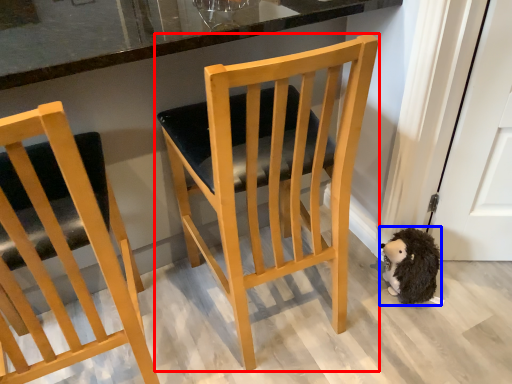
Question: Which object appears closest to the camera in this image, chair (highlighted by a red box) or animal (highlighted by a blue box)?

Choices:
 (A) chair
 (B) animal

Answer: (A)